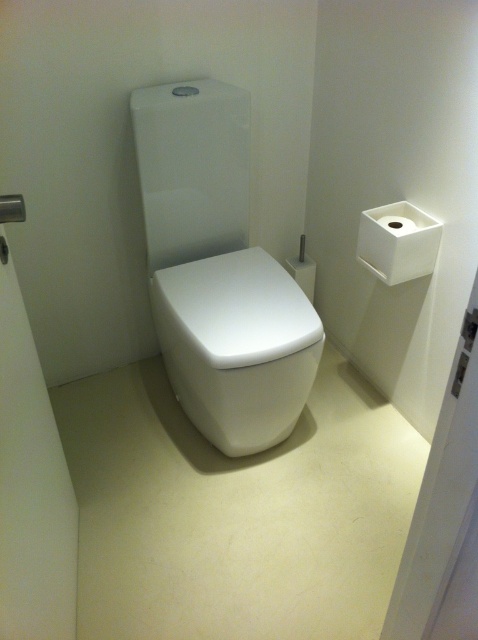
Between white glossy toilet bowl at center and white matte toilet paper at upper right, which one has less height?

white matte toilet paper at upper right is shorter.

Between white glossy toilet bowl at center and white matte toilet paper at upper right, which one appears on the left side from the viewer's perspective?

From the viewer's perspective, white glossy toilet bowl at center appears more on the left side.

Describe the element at coordinates (237, 346) in the screenshot. The height and width of the screenshot is (640, 478). I see `white glossy toilet bowl at center` at that location.

The image size is (478, 640). What are the coordinates of `white glossy toilet bowl at center` in the screenshot? It's located at (237, 346).

Does white glossy toilet bowl at center have a greater width compared to white matte tissue at right?

Indeed, white glossy toilet bowl at center has a greater width compared to white matte tissue at right.

Between white glossy toilet bowl at center and white matte tissue at right, which one is positioned lower?

white glossy toilet bowl at center is below.

Where is `white glossy toilet bowl at center`? The image size is (478, 640). white glossy toilet bowl at center is located at coordinates (237, 346).

Is point (364, 211) less distant than point (402, 227)?

No, it is behind (402, 227).

Does point (400, 259) lie behind point (398, 225)?

That is False.

This screenshot has width=478, height=640. What are the coordinates of `white matte tissue at right` in the screenshot? It's located at pos(398,241).